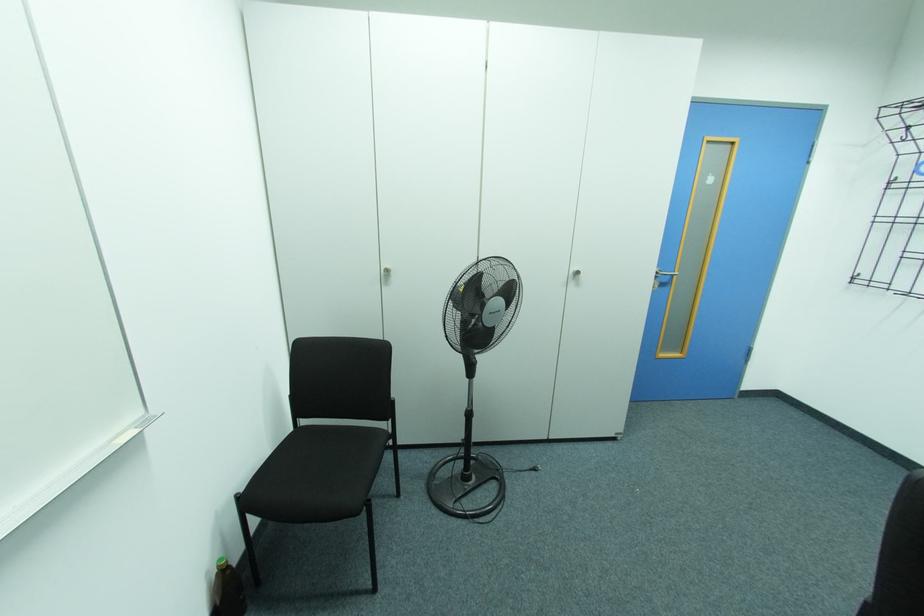
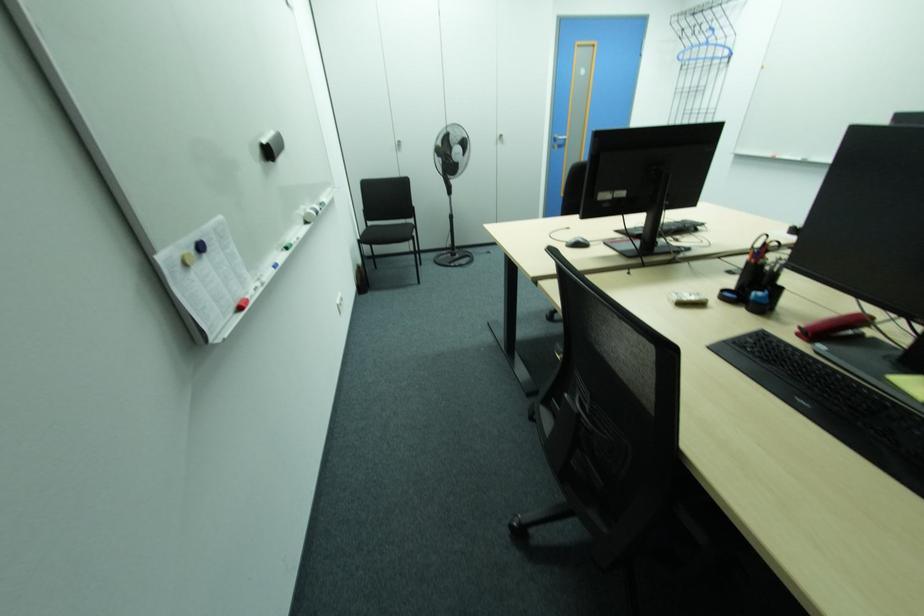
Question: What movement of the cameraman would produce the second image?

Choices:
 (A) Left
 (B) Right
 (C) Forward
 (D) Backward

Answer: (D)